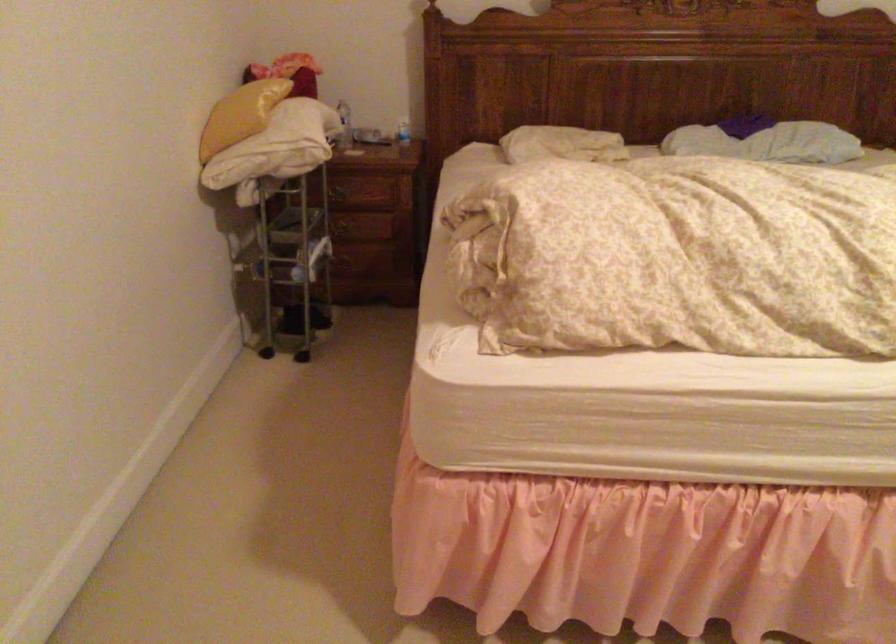
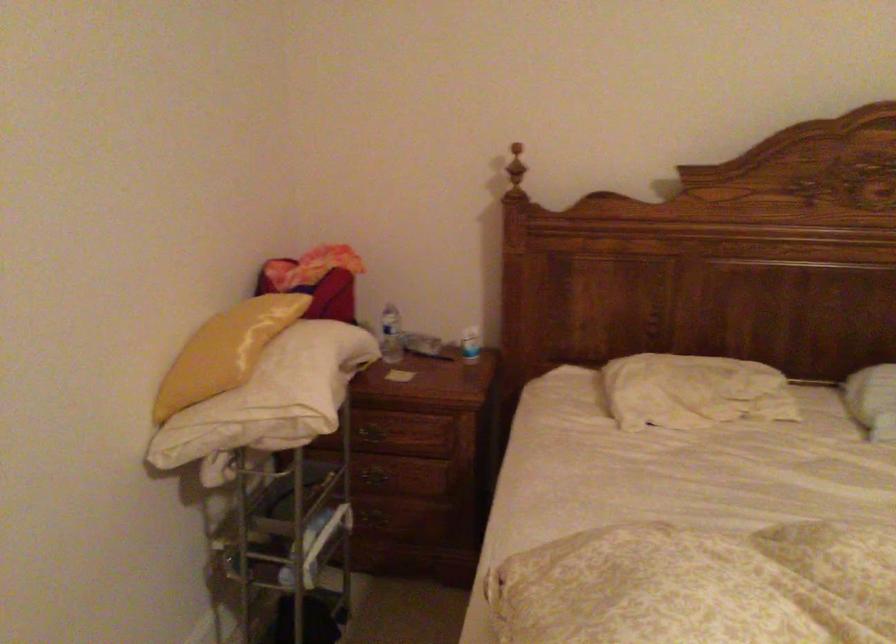
Find the pixel in the second image that matches (409,126) in the first image.

(470, 344)